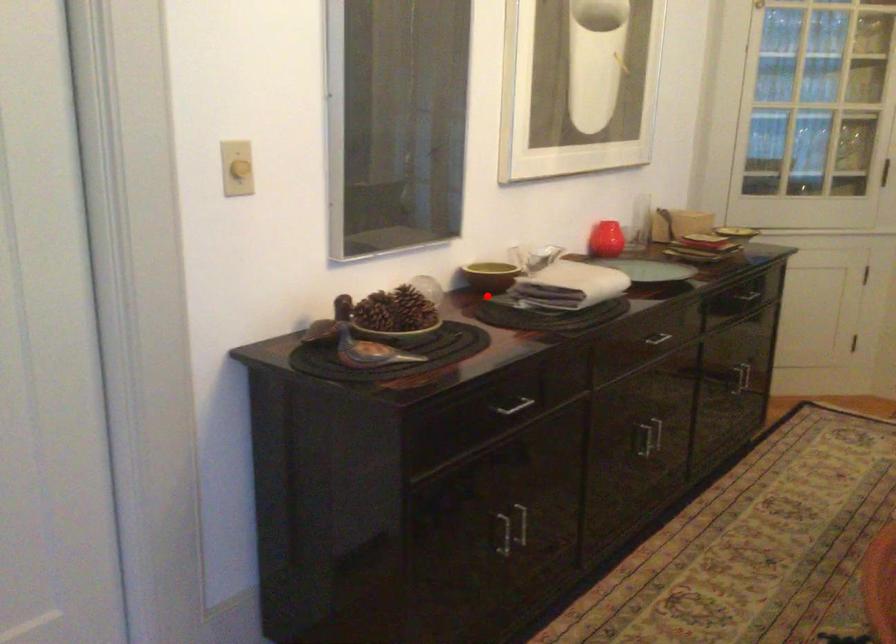
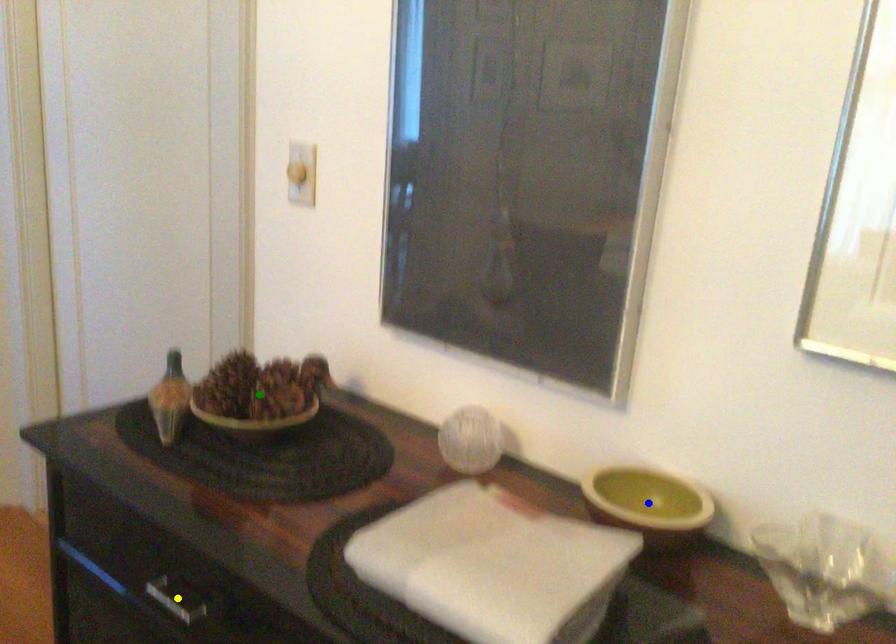
Question: I am providing you with two images of the same scene from different viewpoints. A red point is marked on the first image. You are given multiple points on the second image. Which point in image 2 is actually the same real-world point as the red point in image 1?

Choices:
 (A) yellow point
 (B) blue point
 (C) green point

Answer: (B)